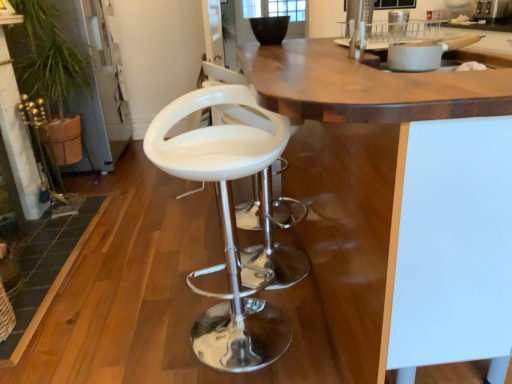
The height and width of the screenshot is (384, 512). Identify the location of vacant space situated on the left part of white glossy bar stool at center. (142, 314).